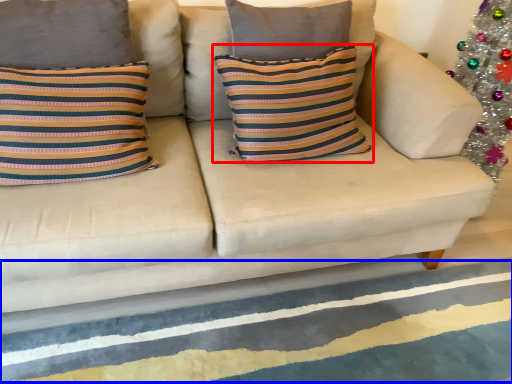
Question: Which object is further to the camera taking this photo, pillow (highlighted by a red box) or stripe (highlighted by a blue box)?

Choices:
 (A) pillow
 (B) stripe

Answer: (A)